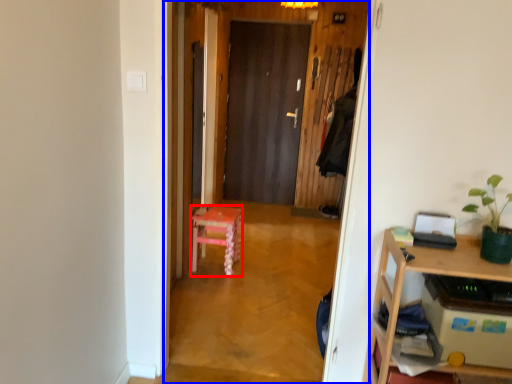
Question: Which point is further to the camera, stool (highlighted by a red box) or corridor (highlighted by a blue box)?

Choices:
 (A) stool
 (B) corridor

Answer: (A)